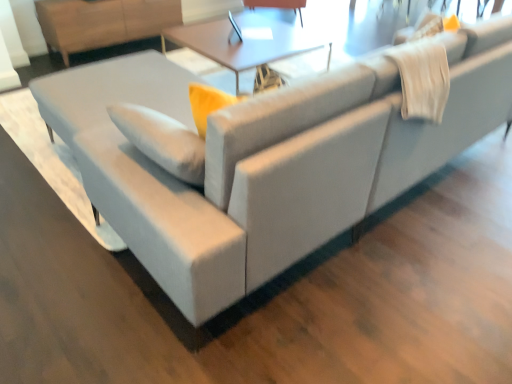
Question: Do you think light brown wood dresser at upper left is within matte black swivel chair at upper center, or outside of it?

Choices:
 (A) inside
 (B) outside

Answer: (B)

Question: Visually, is light brown wood dresser at upper left positioned to the left or to the right of matte black swivel chair at upper center?

Choices:
 (A) left
 (B) right

Answer: (A)

Question: Estimate the real-world distances between objects in this image. Which object is farther from the matte black swivel chair at upper center?

Choices:
 (A) matte white table at center
 (B) light brown wood dresser at upper left

Answer: (B)

Question: Which object is positioned farthest from the light brown wood dresser at upper left?

Choices:
 (A) matte black swivel chair at upper center
 (B) matte white table at center

Answer: (A)